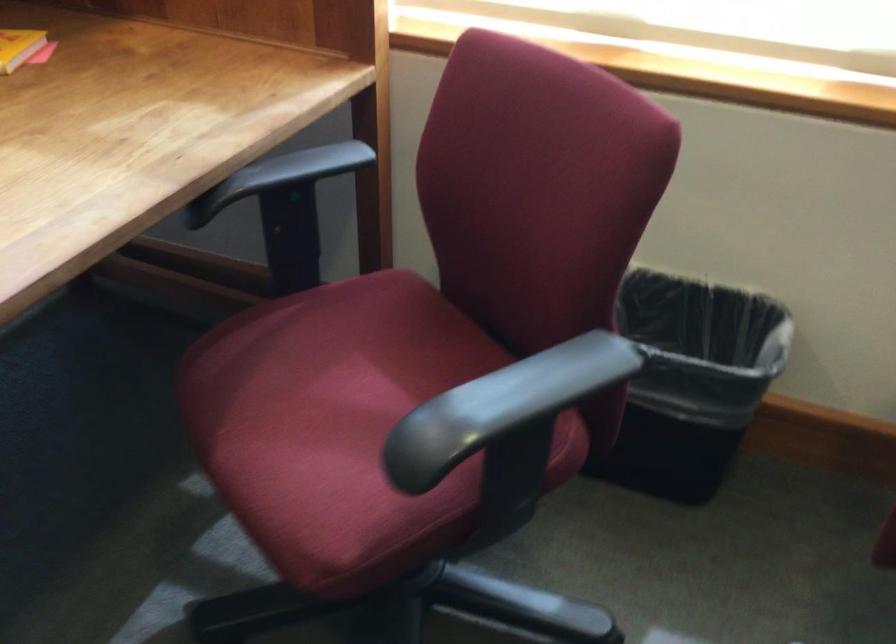
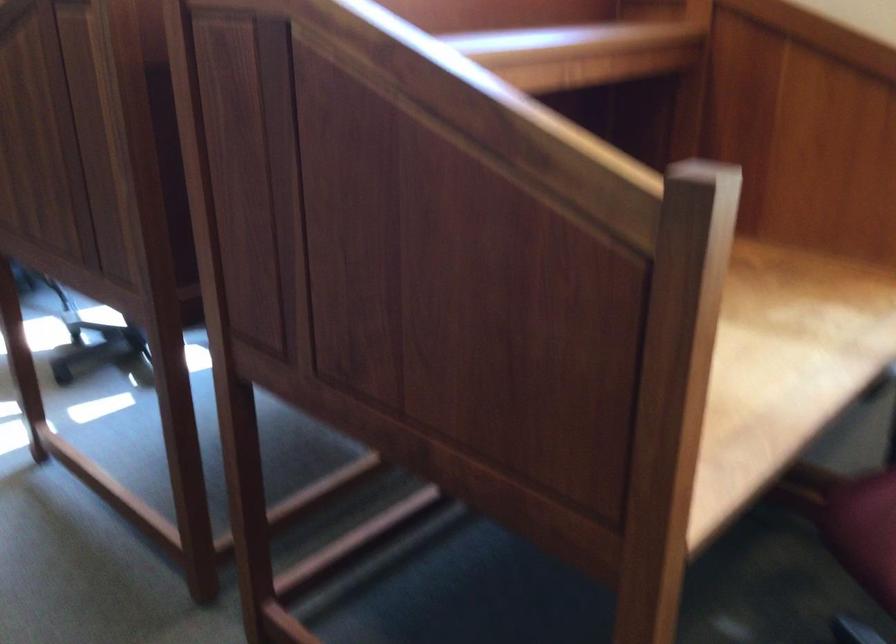
Which direction would the cameraman need to move to produce the second image?

The cameraman moved toward left, backward.